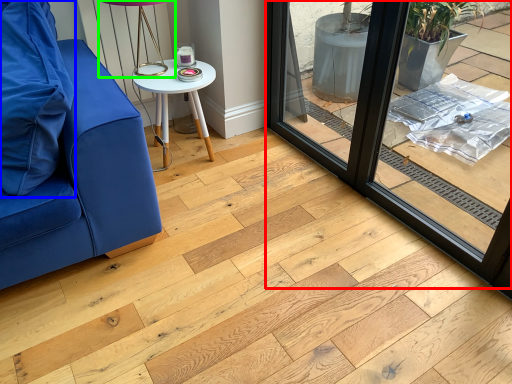
Question: Which is farther away from window frame (highlighted by a red box)? pillow (highlighted by a blue box) or table lamp (highlighted by a green box)?

Choices:
 (A) pillow
 (B) table lamp

Answer: (A)